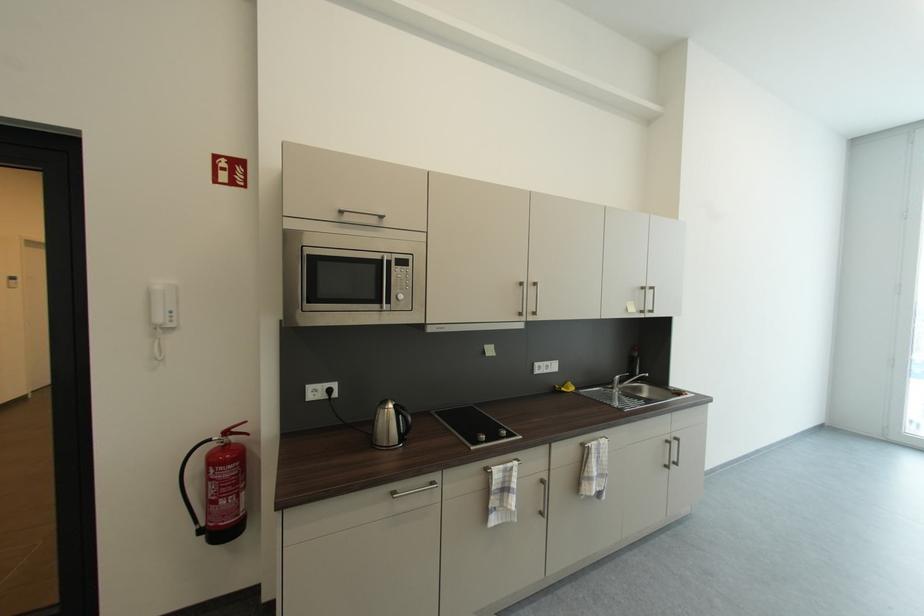
The width and height of the screenshot is (924, 616). Describe the element at coordinates (162, 305) in the screenshot. I see `a intercom handset` at that location.